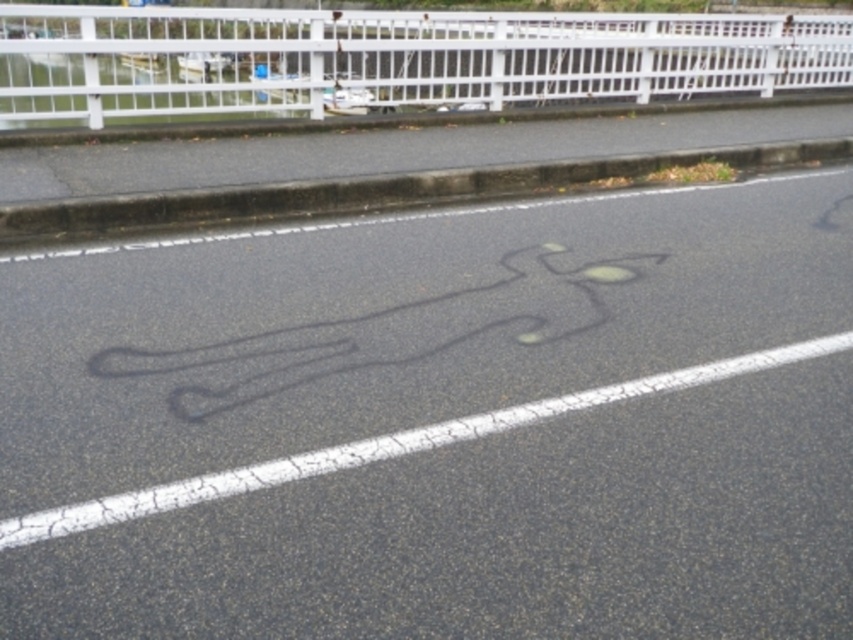
Based on the photo, you are a delivery driver who needs to make a quick stop on the road. There is a black asphalt bike lane at center located at point [440,422]. Can you safely stop your vehicle on the road without entering the black asphalt bike lane at center?

The black asphalt bike lane at center is located at point [440,422]. To safely stop without entering it, you must position your vehicle away from that coordinate. However, since the bike lane is at the center, stopping on either side of it while maintaining a safe distance would be advisable.

You are a cyclist approaching the black asphalt bike lane at center and the white painted metal fence at upper center. Which object is closer to you as you ride towards them?

The black asphalt bike lane at center is closer to you because it is positioned under the white painted metal fence at upper center, meaning the fence is further away.

You are a cyclist approaching the black asphalt bike lane at center and the white painted metal fence at upper center. Which object is nearer to you as you ride towards them?

The black asphalt bike lane at center is closer to the viewer than the white painted metal fence at upper center, so the black asphalt bike lane at center is nearer to you as you ride towards them.